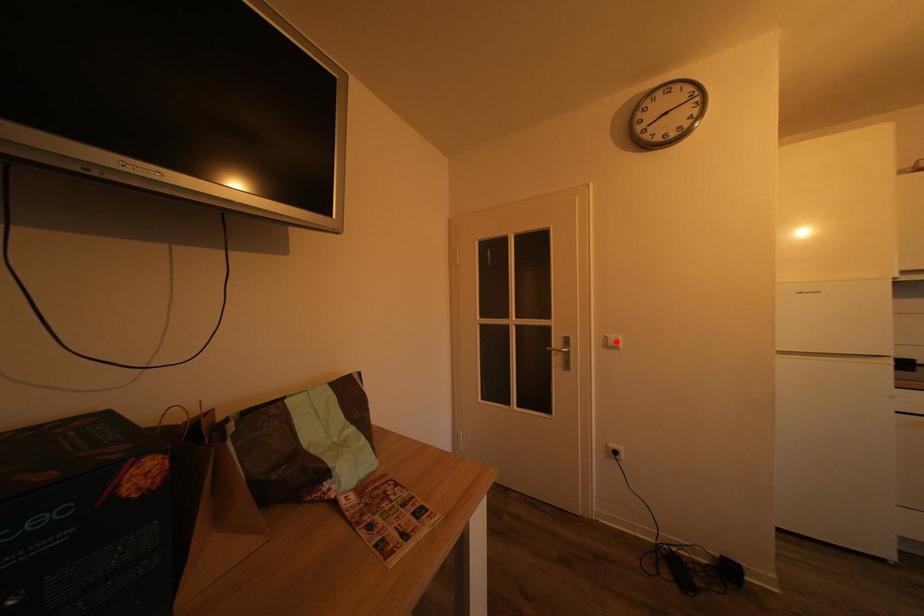
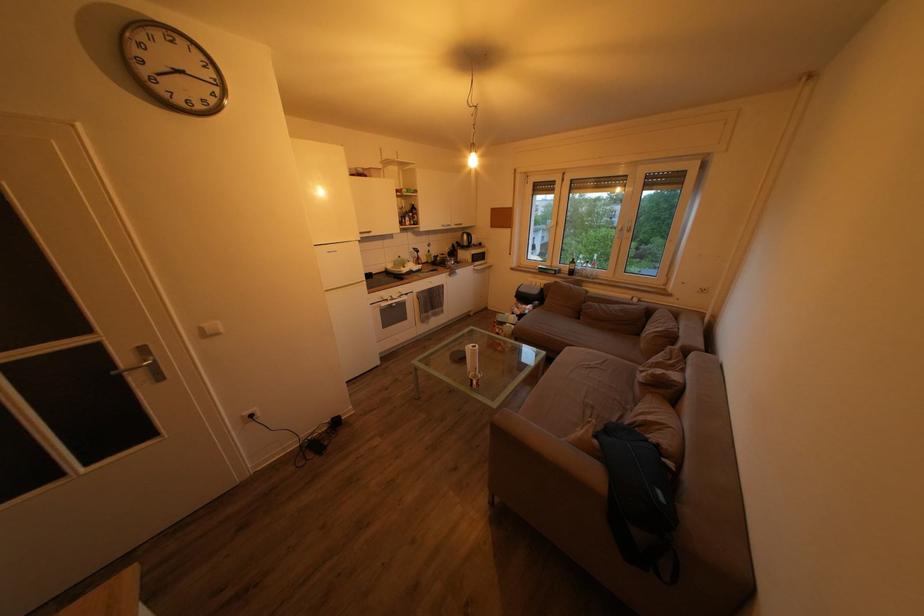
Question: I am providing you with two images of the same scene from different viewpoints. A red point is marked on the first image. At the location where the point appears in image 1, is it still visible in image 2?

Choices:
 (A) Yes
 (B) No

Answer: (A)